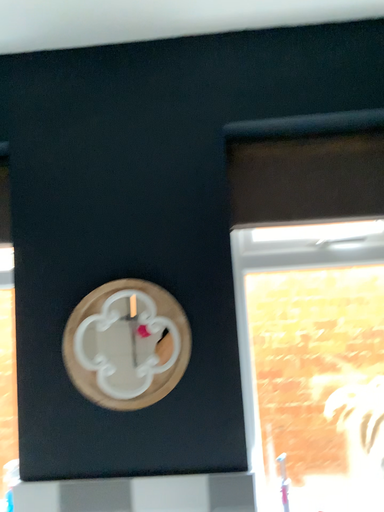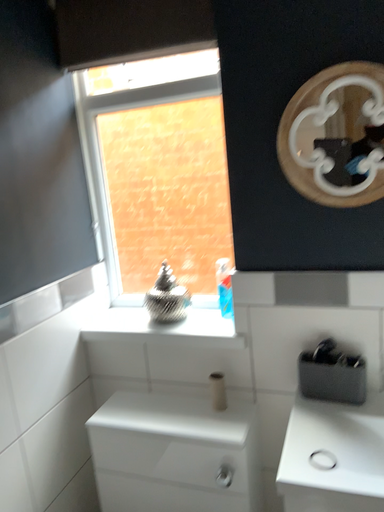
Question: How did the camera likely rotate when shooting the video?

Choices:
 (A) rotated right
 (B) rotated left

Answer: (B)